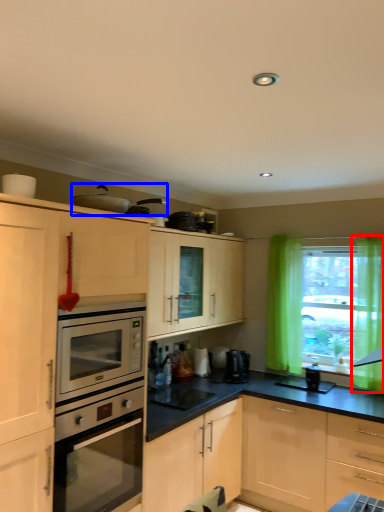
Question: Among these objects, which one is farthest to the camera, curtain (highlighted by a red box) or appliance (highlighted by a blue box)?

Choices:
 (A) curtain
 (B) appliance

Answer: (A)